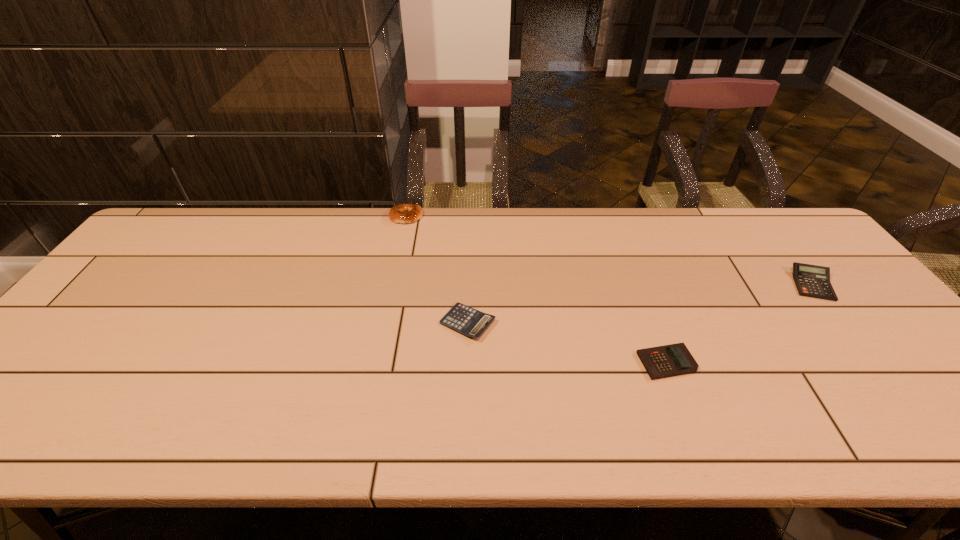
I want to click on vacant space located 0.150m on the right of the second calculator from right to left, so click(x=758, y=362).

Identify the location of vacant space located on the left of the second nearest calculator. The height and width of the screenshot is (540, 960). (334, 323).

The image size is (960, 540). Find the location of `object at the far edge`. object at the far edge is located at coordinates (402, 213).

The height and width of the screenshot is (540, 960). Identify the location of object that is at the right edge. (813, 281).

Where is `vacant space at the far edge`? The height and width of the screenshot is (540, 960). vacant space at the far edge is located at coordinates (460, 232).

The width and height of the screenshot is (960, 540). Identify the location of vacant space at the left edge of the desktop. (122, 269).

Find the location of a particular element. vacant area at the right edge of the desktop is located at coordinates (903, 393).

Locate an element on the screen. blank space at the near left corner of the desktop is located at coordinates (18, 434).

Where is `vacant region at the near right corner`? vacant region at the near right corner is located at coordinates (941, 433).

Where is `unoccupied position between the bagel and the nearest object`? The width and height of the screenshot is (960, 540). unoccupied position between the bagel and the nearest object is located at coordinates (537, 289).